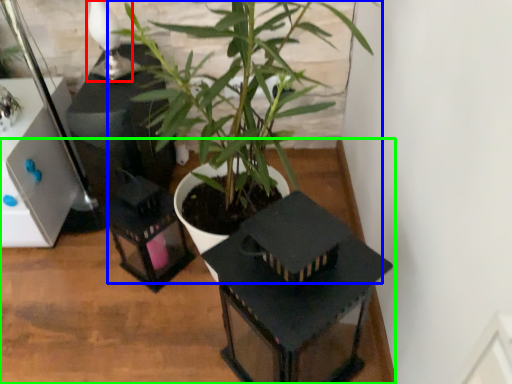
Question: Which is nearer to the table lamp (highlighted by a red box)? houseplant (highlighted by a blue box) or table (highlighted by a green box).

Choices:
 (A) houseplant
 (B) table

Answer: (A)